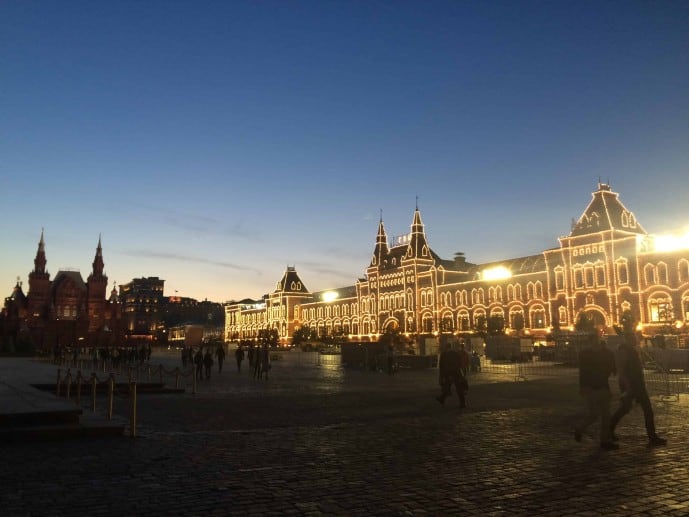
Locate an element on the screen. The width and height of the screenshot is (689, 517). metal finials is located at coordinates (417, 196), (382, 209), (100, 234), (43, 229).